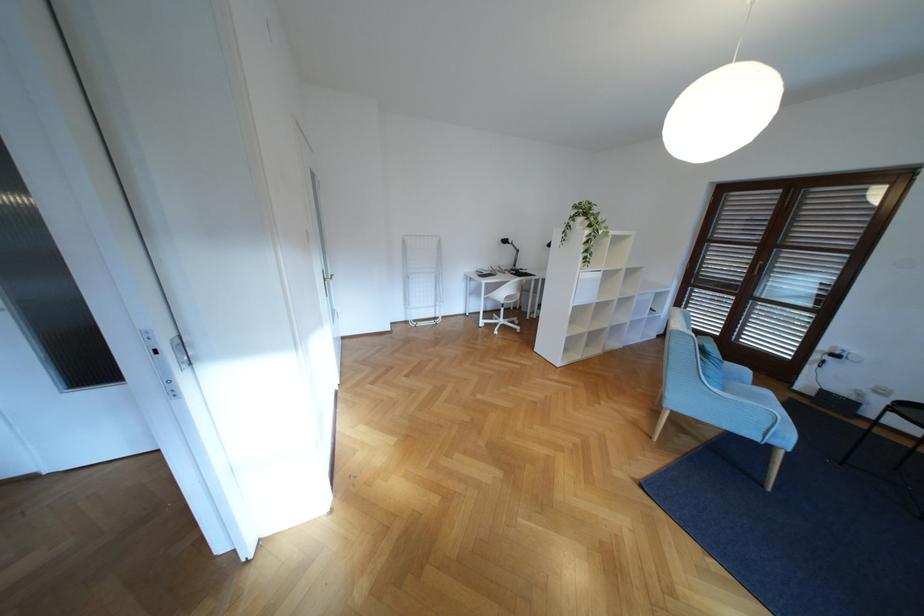
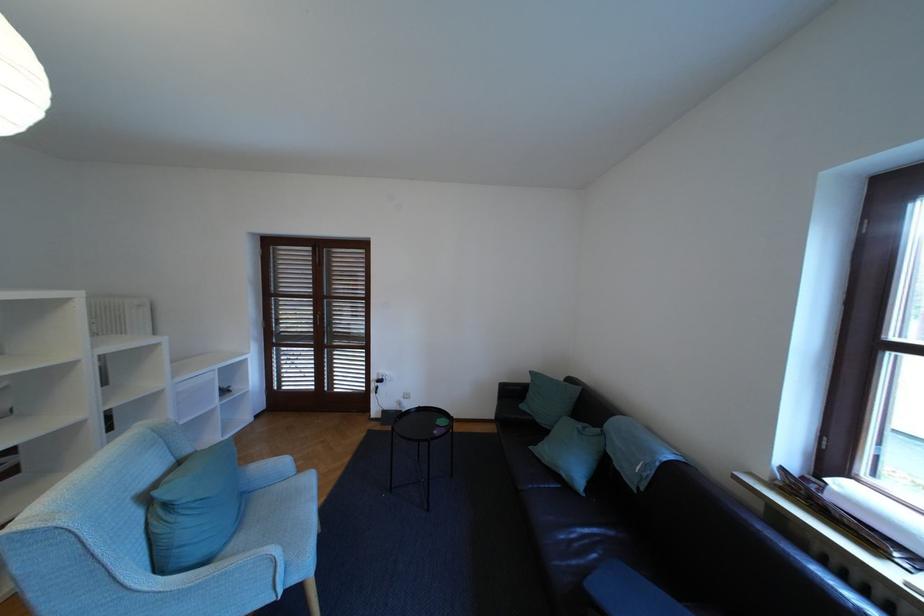
Locate, in the second image, the point that corresponds to the point at 756,278 in the first image.

(323, 328)